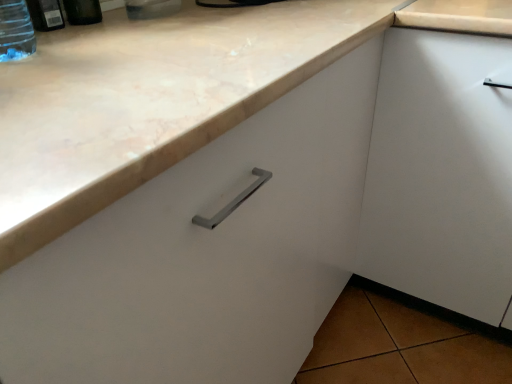
Question: Is marble countertop at upper left facing towards transparent plastic bottle at upper left, marked as the 2th bottle in a left-to-right arrangement?

Choices:
 (A) no
 (B) yes

Answer: (A)

Question: Is marble countertop at upper left smaller than transparent plastic bottle at upper left, marked as the 2th bottle in a left-to-right arrangement?

Choices:
 (A) no
 (B) yes

Answer: (A)

Question: Is marble countertop at upper left taller than transparent plastic bottle at upper left, marked as the 2th bottle in a left-to-right arrangement?

Choices:
 (A) no
 (B) yes

Answer: (B)

Question: From the image's perspective, is marble countertop at upper left under transparent plastic bottle at upper left, marked as the 2th bottle in a left-to-right arrangement?

Choices:
 (A) no
 (B) yes

Answer: (B)

Question: From a real-world perspective, does marble countertop at upper left sit lower than transparent plastic bottle at upper left, marked as the 2th bottle in a left-to-right arrangement?

Choices:
 (A) yes
 (B) no

Answer: (A)

Question: Considering the positions of transparent plastic bottle at upper left, marked as the 2th bottle in a left-to-right arrangement, and transparent plastic bottle at upper left, which ranks as the third bottle in right-to-left order, in the image, is transparent plastic bottle at upper left, marked as the 2th bottle in a left-to-right arrangement, taller or shorter than transparent plastic bottle at upper left, which ranks as the third bottle in right-to-left order,?

Choices:
 (A) short
 (B) tall

Answer: (A)

Question: Is point (38, 1) closer or farther from the camera than point (19, 43)?

Choices:
 (A) closer
 (B) farther

Answer: (B)

Question: From a real-world perspective, is transparent plastic bottle at upper left, marked as the 2th bottle in a left-to-right arrangement, positioned above or below transparent plastic bottle at upper left, the first bottle in the left-to-right sequence?

Choices:
 (A) below
 (B) above

Answer: (A)

Question: In terms of size, does transparent plastic bottle at upper left, marked as the 2th bottle in a left-to-right arrangement, appear bigger or smaller than transparent plastic bottle at upper left, the first bottle in the left-to-right sequence?

Choices:
 (A) big
 (B) small

Answer: (B)

Question: Would you say matte plastic bottle at upper left, the first bottle in the right-to-left sequence, is inside or outside transparent plastic bottle at upper left, placed as the second bottle when sorted from right to left?

Choices:
 (A) outside
 (B) inside

Answer: (A)

Question: From a real-world perspective, relative to transparent plastic bottle at upper left, placed as the second bottle when sorted from right to left, is matte plastic bottle at upper left, the first bottle in the right-to-left sequence, vertically above or below?

Choices:
 (A) below
 (B) above

Answer: (B)

Question: Is matte plastic bottle at upper left, the first bottle in the right-to-left sequence, taller or shorter than transparent plastic bottle at upper left, placed as the second bottle when sorted from right to left?

Choices:
 (A) tall
 (B) short

Answer: (A)

Question: In the image, is matte plastic bottle at upper left, the 3th bottle positioned from the left, on the left side or the right side of transparent plastic bottle at upper left, placed as the second bottle when sorted from right to left?

Choices:
 (A) left
 (B) right

Answer: (B)

Question: From the image's perspective, is transparent plastic bottle at upper left, the first bottle in the left-to-right sequence, located above or below transparent plastic bottle at upper left, marked as the 2th bottle in a left-to-right arrangement?

Choices:
 (A) above
 (B) below

Answer: (B)

Question: In terms of height, does transparent plastic bottle at upper left, the first bottle in the left-to-right sequence, look taller or shorter compared to transparent plastic bottle at upper left, placed as the second bottle when sorted from right to left?

Choices:
 (A) tall
 (B) short

Answer: (A)